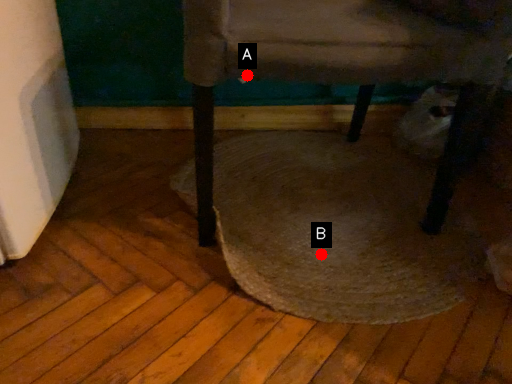
Question: Two points are circled on the image, labeled by A and B beside each circle. Which point appears closest to the camera in this image?

Choices:
 (A) A is closer
 (B) B is closer

Answer: (A)